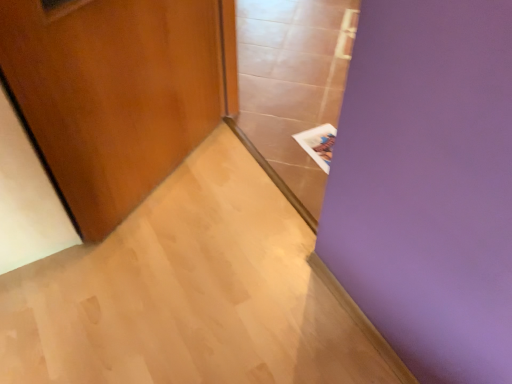
Image resolution: width=512 pixels, height=384 pixels. I want to click on vacant space situated above white paper at upper right (from a real-world perspective), so click(320, 139).